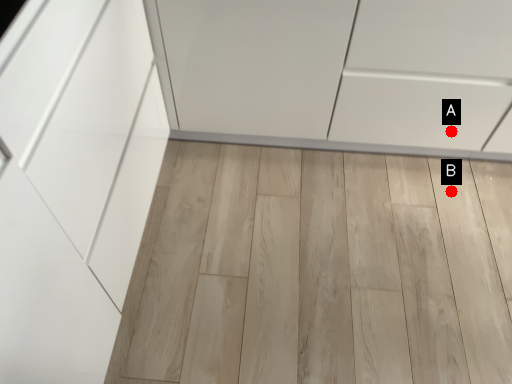
Question: Two points are circled on the image, labeled by A and B beside each circle. Among these points, which one is nearest to the camera?

Choices:
 (A) A is closer
 (B) B is closer

Answer: (A)